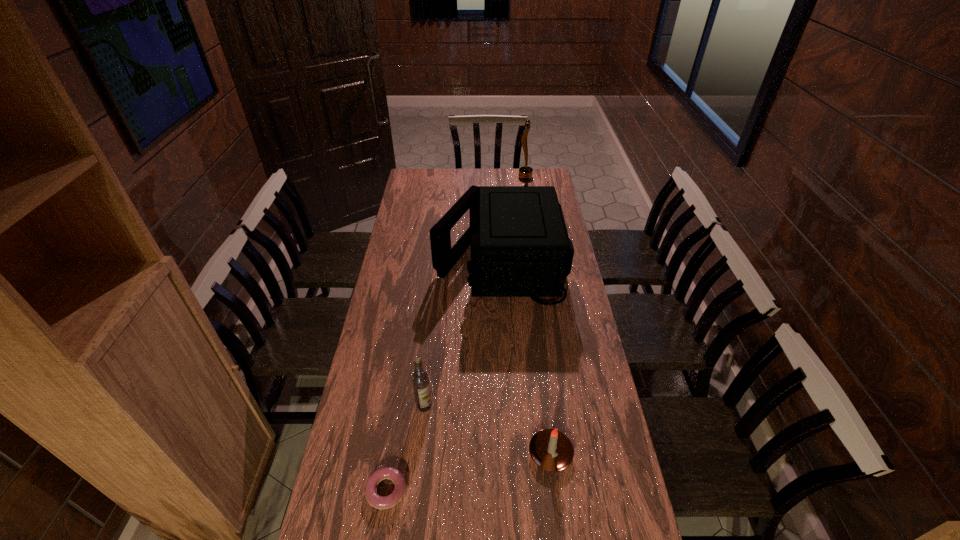
What are the coordinates of `empty location between the tallest object and the doughnut` in the screenshot? It's located at (456, 334).

Locate an element on the screen. The image size is (960, 540). vacant area between the candle and the doughnut is located at coordinates (468, 472).

Find the location of a particular element. object that is the fourth closest to the microwave oven is located at coordinates (379, 502).

You are a GUI agent. You are given a task and a screenshot of the screen. Output one action in this format:
    pyautogui.click(x=<x>, y=<y>)
    Task: Click on the object that ranks as the fourth closest to the farthest object
    Image resolution: width=960 pixels, height=540 pixels.
    Given the screenshot: What is the action you would take?
    pyautogui.click(x=379, y=502)

The height and width of the screenshot is (540, 960). What are the coordinates of `vacant space that satisfies the following two spatial constraints: 1. with the door open on the second farthest object; 2. on the right side of the candle` in the screenshot? It's located at (512, 454).

This screenshot has height=540, width=960. Find the location of `vacant space that satisfies the following two spatial constraints: 1. with the door open on the microwave oven; 2. on the front side of the doughnut`. vacant space that satisfies the following two spatial constraints: 1. with the door open on the microwave oven; 2. on the front side of the doughnut is located at coordinates (515, 490).

Where is `vacant space that satisfies the following two spatial constraints: 1. on the label of the third tallest object; 2. on the left side of the candle`? The image size is (960, 540). vacant space that satisfies the following two spatial constraints: 1. on the label of the third tallest object; 2. on the left side of the candle is located at coordinates (420, 454).

Image resolution: width=960 pixels, height=540 pixels. What are the coordinates of `vacant region that satisfies the following two spatial constraints: 1. on the label of the vodka; 2. on the left side of the second shortest object` in the screenshot? It's located at (420, 454).

The width and height of the screenshot is (960, 540). What are the coordinates of `free spot that satisfies the following two spatial constraints: 1. with the door open on the second farthest object; 2. on the label of the third shortest object` in the screenshot? It's located at (510, 406).

Locate an element on the screen. Image resolution: width=960 pixels, height=540 pixels. vacant region that satisfies the following two spatial constraints: 1. on the label of the candle; 2. on the left side of the third shortest object is located at coordinates (420, 454).